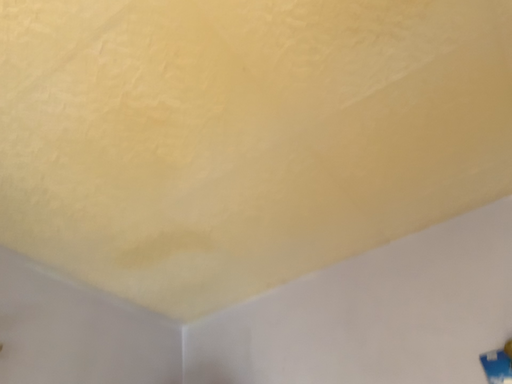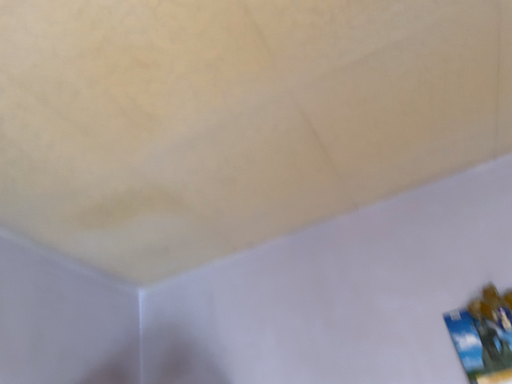
Question: How did the camera likely rotate when shooting the video?

Choices:
 (A) rotated left
 (B) rotated right

Answer: (B)